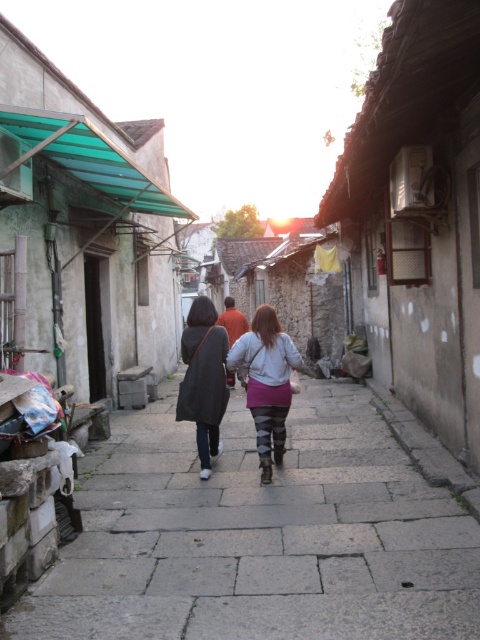
You are standing at the entrance of the alley and want to reach a specific point located at point (259, 324). Given that you can walk at a speed of 3 feet per second, how many seconds will it take you to reach that point?

The distance between you and point (259, 324) is 21.67 feet. At a walking speed of 3 feet per second, it will take approximately 7.22 seconds to reach the point.